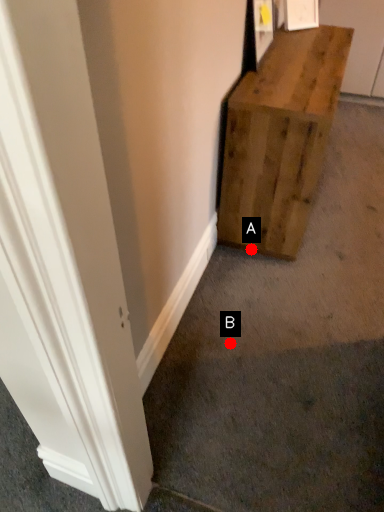
Question: Two points are circled on the image, labeled by A and B beside each circle. Which point is further to the camera?

Choices:
 (A) A is further
 (B) B is further

Answer: (A)